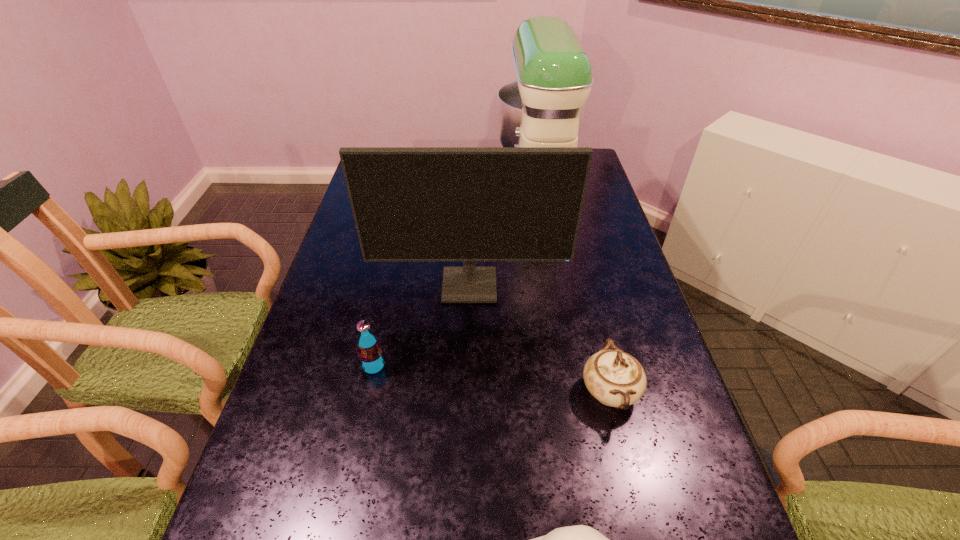
You are a GUI agent. You are given a task and a screenshot of the screen. Output one action in this format:
    pyautogui.click(x=<x>, y=<y>)
    Task: Click on the free space between the chinaware and the second tallest object
    The image size is (960, 540).
    Given the screenshot: What is the action you would take?
    pyautogui.click(x=540, y=339)

Locate an element on the screen. free space between the chinaware and the soda is located at coordinates (492, 379).

Where is `free space that is in between the second tallest object and the chinaware`? The width and height of the screenshot is (960, 540). free space that is in between the second tallest object and the chinaware is located at coordinates coord(540,339).

Select which object is the second closest to the farthest object. Please provide its 2D coordinates. Your answer should be formatted as a tuple, i.e. [(x, y)], where the tuple contains the x and y coordinates of a point satisfying the conditions above.

[(615, 378)]

The image size is (960, 540). I want to click on object that is the closest to the chinaware, so click(469, 204).

Where is `free spot that satisfies the following two spatial constraints: 1. on the back side of the chinaware; 2. on the controls of the mixer`? This screenshot has height=540, width=960. free spot that satisfies the following two spatial constraints: 1. on the back side of the chinaware; 2. on the controls of the mixer is located at coordinates (558, 183).

Where is `free spot that satisfies the following two spatial constraints: 1. on the controls of the farthest object; 2. on the front-facing side of the second farthest object`? free spot that satisfies the following two spatial constraints: 1. on the controls of the farthest object; 2. on the front-facing side of the second farthest object is located at coordinates coord(556,287).